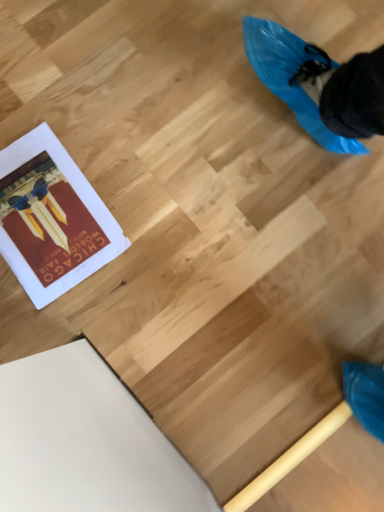
The width and height of the screenshot is (384, 512). What are the coordinates of `free point behind matte paper poster at lower left` in the screenshot? It's located at (82, 106).